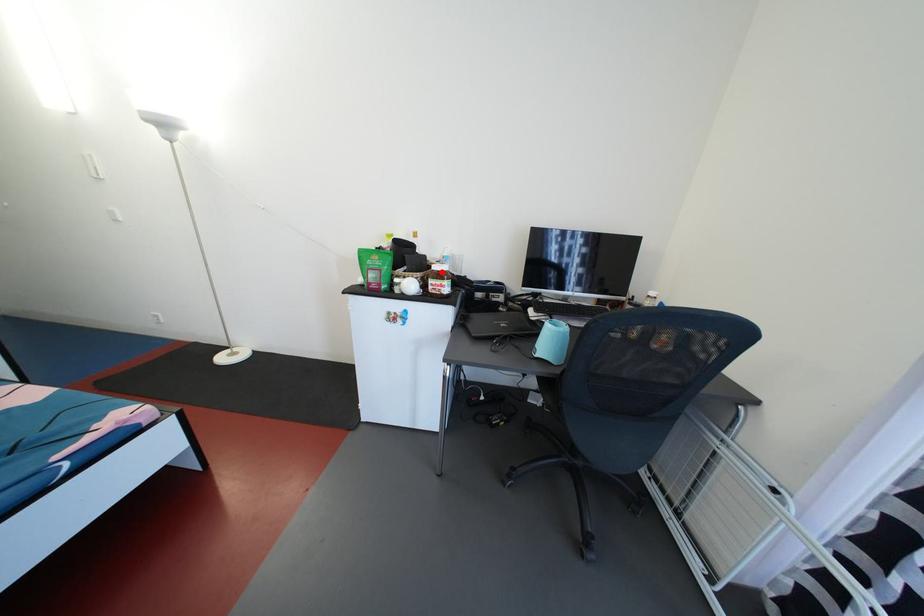
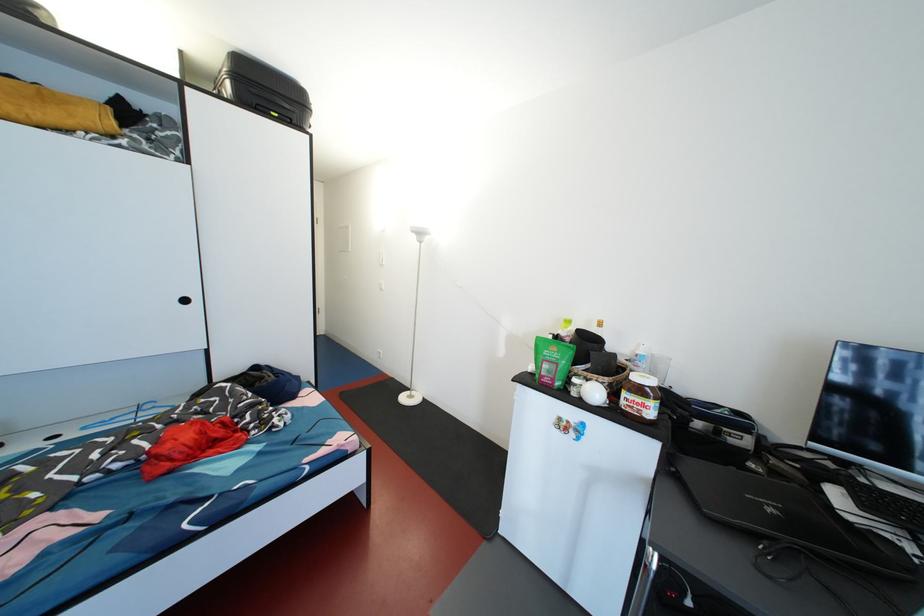
In the second image, find the point that corresponds to the highlighted location in the first image.

(641, 383)